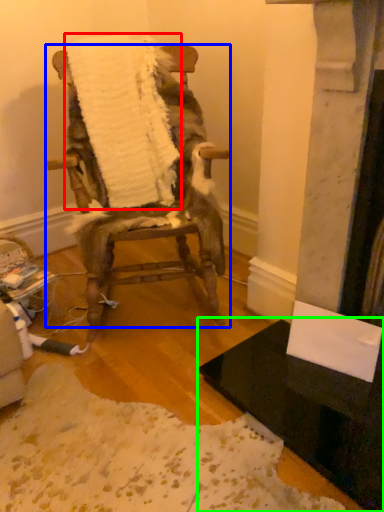
Question: Which is farther away from blanket (highlighted by a red box)? chair (highlighted by a blue box) or table (highlighted by a green box)?

Choices:
 (A) chair
 (B) table

Answer: (B)